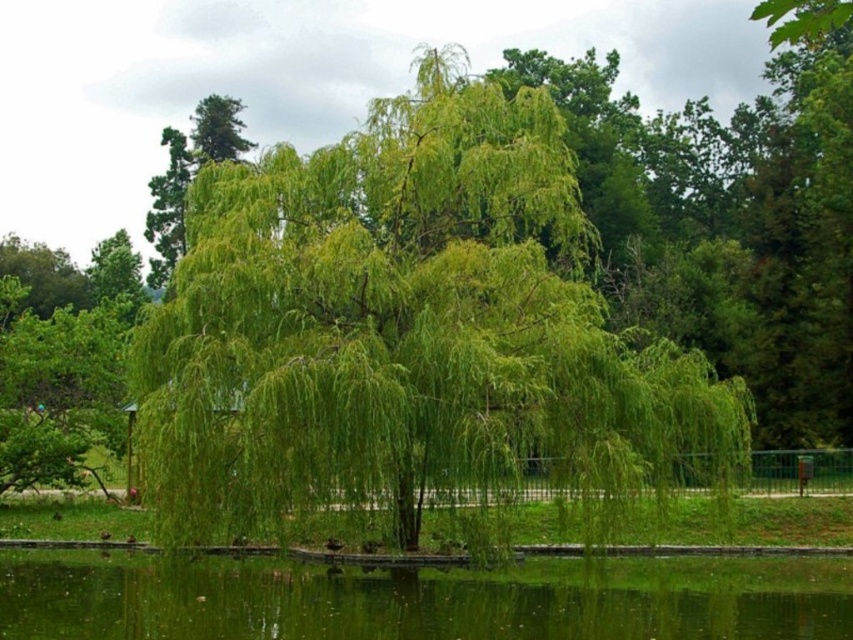
You are standing in the park and see two points marked in the image. The first point is at coordinates point (305, 467) and the second is at point (718, 604). If you want to walk from the first point to the second point, will you pass through the area where the weeping willow tree is located?

Since point (305, 467) is in front of point (718, 604), you would not pass through the weeping willow tree area as the first point is closer to you than the second point, implying the path goes around or past the tree rather than through it.

You are standing in the park and want to reach the point marked at coordinates (x=381, y=205). Given that the park has a walking path that is 20 meters long, can you walk directly to that point without going beyond the path?

The point marked at coordinates (x=381, y=205) is 21.03 meters away from you, which is longer than the 20 meters walking path available. Therefore, you cannot reach it directly without exceeding the path length.

You are planning to place a small wooden bench in the park scene. The bench requires a space wider than the green liquid water at lower center. Can the area near the green leafy willow at center accommodate this bench?

The green leafy willow at center has a greater width than the green liquid water at lower center, so the area near the green leafy willow at center can accommodate the bench as it provides sufficient space.